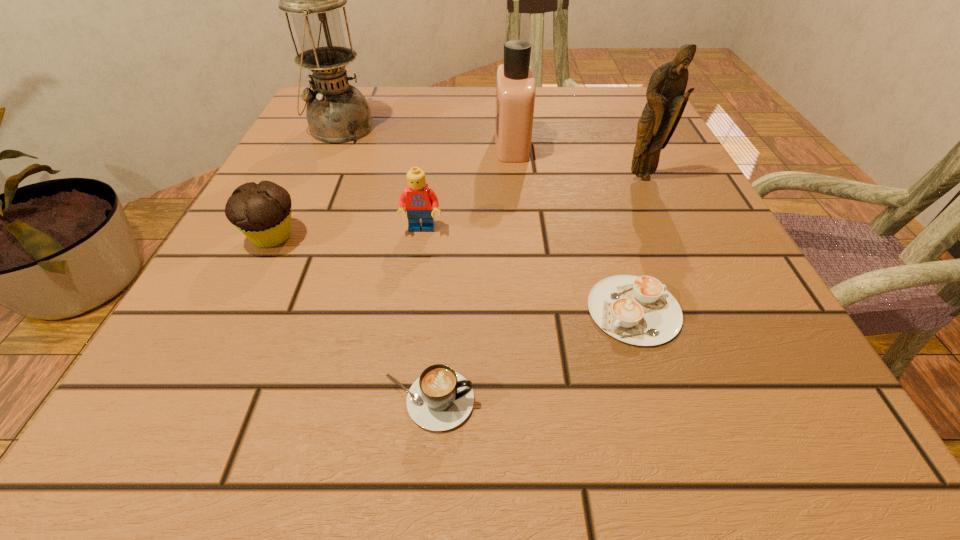
What are the coordinates of `vacant space at the left edge of the desktop` in the screenshot? It's located at (231, 319).

Image resolution: width=960 pixels, height=540 pixels. In the image, there is a desktop. What are the coordinates of `free space at the right edge` in the screenshot? It's located at (659, 264).

Identify the location of vacant area at the far left corner. (370, 104).

This screenshot has height=540, width=960. What are the coordinates of `vacant space at the near right corner` in the screenshot? It's located at (775, 399).

Identify the location of free space between the fifth nearest object and the muffin. (457, 207).

Identify the location of vacant space that's between the farther cappuccino and the second shortest object. Image resolution: width=960 pixels, height=540 pixels. coord(531,355).

Identify the location of free space between the tallest object and the third farthest object. The height and width of the screenshot is (540, 960). (491, 153).

Where is `blank region between the farther cappuccino and the tallest object`? blank region between the farther cappuccino and the tallest object is located at coordinates (487, 219).

You are a GUI agent. You are given a task and a screenshot of the screen. Output one action in this format:
    pyautogui.click(x=<x>, y=<y>)
    Task: Click on the free space between the shortest object and the fifth nearest object
    
    Given the screenshot: What is the action you would take?
    tap(637, 244)

Locate an element on the screen. The height and width of the screenshot is (540, 960). free space between the second shortest object and the tallest object is located at coordinates (384, 264).